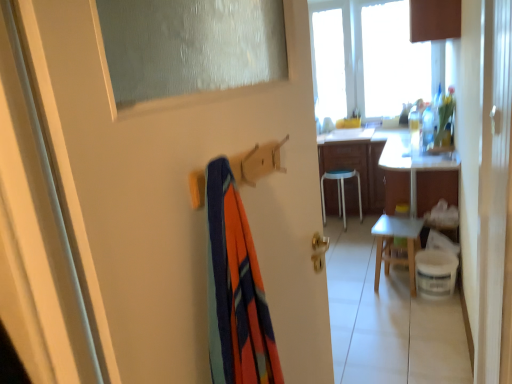
Question: Is white glossy desk at right wider or thinner than wooden chair at center?

Choices:
 (A) thin
 (B) wide

Answer: (B)

Question: Is point (437, 160) positioned closer to the camera than point (414, 241)?

Choices:
 (A) closer
 (B) farther

Answer: (A)

Question: Based on their sizes in the image, would you say white glossy desk at right is bigger or smaller than wooden chair at center?

Choices:
 (A) small
 (B) big

Answer: (B)

Question: From the image's perspective, is wooden chair at center above or below white glossy desk at right?

Choices:
 (A) above
 (B) below

Answer: (B)

Question: Looking at the image, does wooden chair at center seem bigger or smaller compared to white glossy desk at right?

Choices:
 (A) small
 (B) big

Answer: (A)

Question: Is wooden chair at center wider or thinner than white glossy desk at right?

Choices:
 (A) thin
 (B) wide

Answer: (A)

Question: Is wooden chair at center inside or outside of white glossy desk at right?

Choices:
 (A) inside
 (B) outside

Answer: (B)